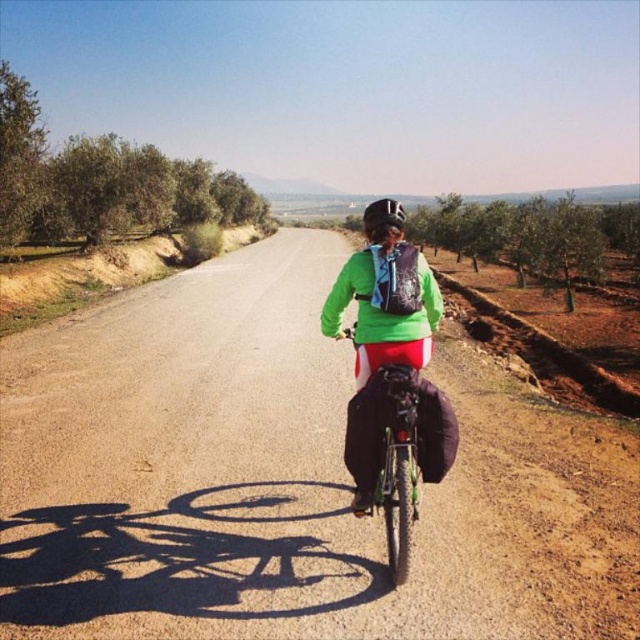
Based on the photo, does brown gravel road at center have a greater height compared to green matte bicycle at center?

Yes, brown gravel road at center is taller than green matte bicycle at center.

This screenshot has height=640, width=640. Identify the location of brown gravel road at center. (285, 480).

Does green matte jacket at center have a greater width compared to green matte bicycle at center?

Yes, green matte jacket at center is wider than green matte bicycle at center.

Does green matte jacket at center have a larger size compared to green matte bicycle at center?

Correct, green matte jacket at center is larger in size than green matte bicycle at center.

Does point (364, 490) come farther from viewer compared to point (385, 372)?

Yes.

You are a GUI agent. You are given a task and a screenshot of the screen. Output one action in this format:
    pyautogui.click(x=<x>, y=<y>)
    Task: Click on the green matte jacket at center
    
    Given the screenshot: What is the action you would take?
    pyautogui.click(x=392, y=384)

Between brown gravel road at center and green matte jacket at center, which one has more height?

Standing taller between the two is brown gravel road at center.

Is brown gravel road at center to the left of green matte jacket at center from the viewer's perspective?

Indeed, brown gravel road at center is positioned on the left side of green matte jacket at center.

Is point (168, 428) behind point (376, 508)?

Yes, point (168, 428) is behind point (376, 508).

Where is `brown gravel road at center`? brown gravel road at center is located at coordinates (285, 480).